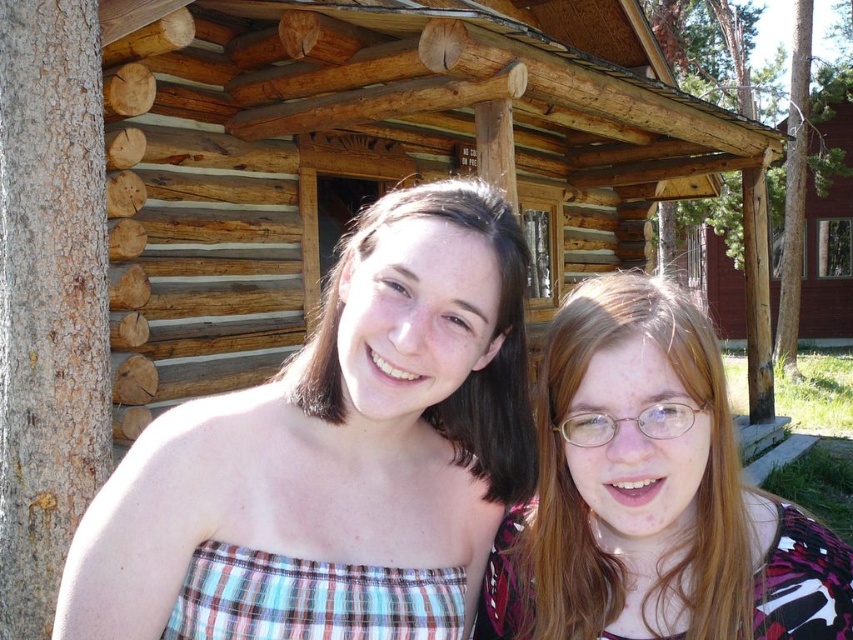
You are a photographer taking a portrait of the two people in front of the rustic log cabin. You want to ensure that both the clear plastic glasses at center and the matte brown hair at center are visible in the frame. Given their positions and the description provided, will you need to adjust the camera angle to include both elements?

The clear plastic glasses at center is taller than matte brown hair at center. Since the glasses are taller, you may need to adjust the camera angle slightly upward to ensure both elements are fully visible in the frame.

You are standing 5 feet away from the rustic log cabin and want to take a photo of the plaid fabric top at center. Can you step forward to get a closer shot without exceeding the minimum safe distance of 4 feet from the top?

The plaid fabric top at center is currently 4.26 feet away from you. Since you want to get closer than 5 feet but must stay at least 4 feet away, stepping forward to 4.26 feet would place you exactly at its current distance. To comply with the minimum safe distance of 4 feet, you could move slightly closer to about 4.0 feet, but ensure you don not go below that limit.